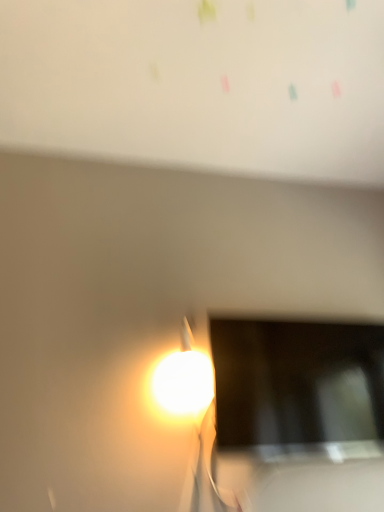
Question: From their relative heights in the image, would you say white matte bulletin board at upper center is taller or shorter than matte black screen at lower right?

Choices:
 (A) tall
 (B) short

Answer: (B)

Question: Would you say white matte bulletin board at upper center is to the left or to the right of matte black screen at lower right in the picture?

Choices:
 (A) left
 (B) right

Answer: (A)

Question: Looking at the image, does white matte bulletin board at upper center seem bigger or smaller compared to matte black screen at lower right?

Choices:
 (A) small
 (B) big

Answer: (B)

Question: In terms of size, does matte black screen at lower right appear bigger or smaller than white matte bulletin board at upper center?

Choices:
 (A) big
 (B) small

Answer: (B)

Question: From the image's perspective, is matte black screen at lower right above or below white matte bulletin board at upper center?

Choices:
 (A) below
 (B) above

Answer: (A)

Question: From their relative heights in the image, would you say matte black screen at lower right is taller or shorter than white matte bulletin board at upper center?

Choices:
 (A) tall
 (B) short

Answer: (A)

Question: From a real-world perspective, is matte black screen at lower right positioned above or below white matte bulletin board at upper center?

Choices:
 (A) below
 (B) above

Answer: (A)